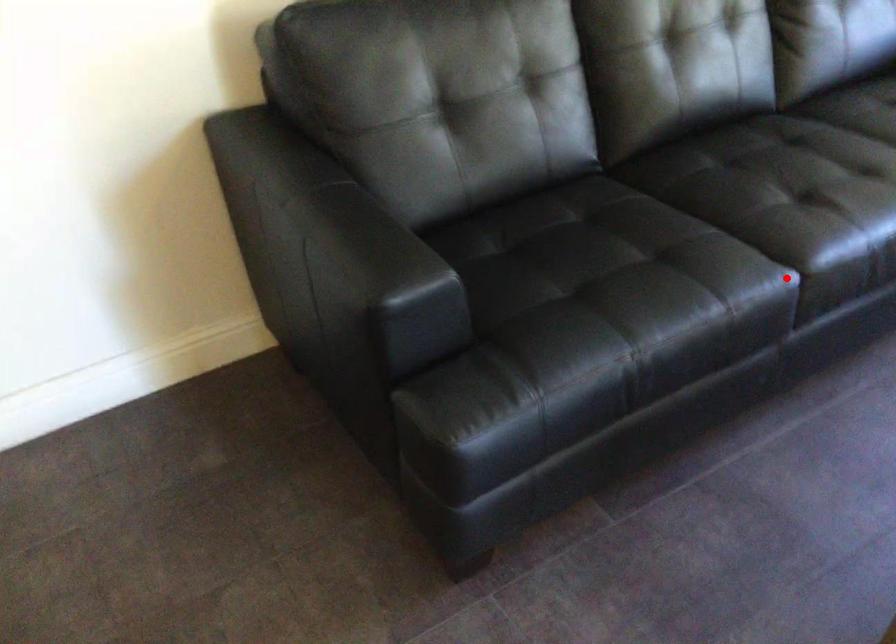
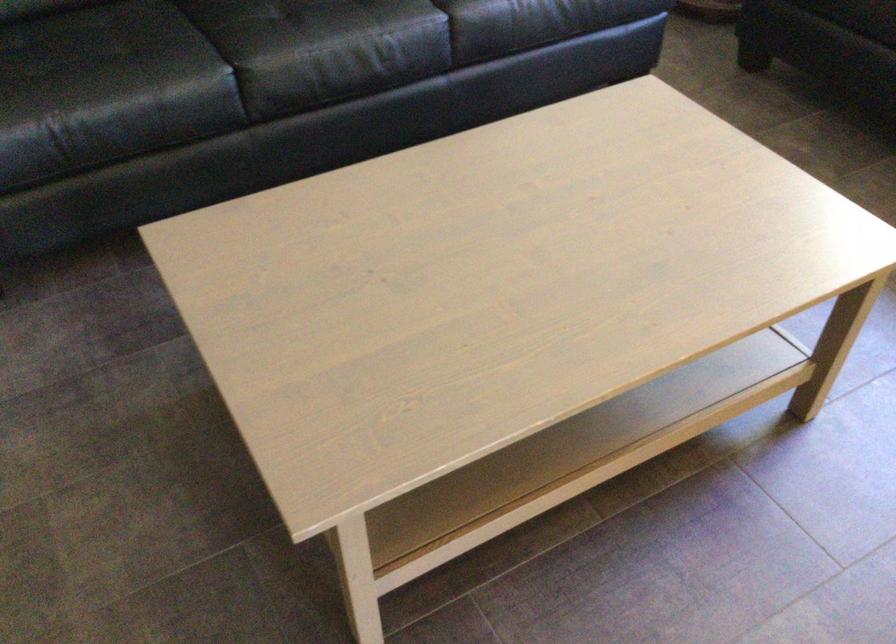
Locate, in the second image, the point that corresponds to the highlighted location in the first image.

(221, 78)